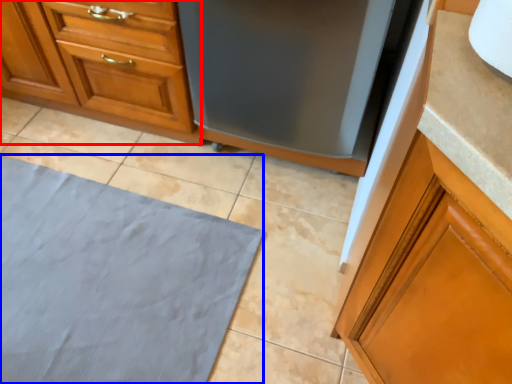
Question: Which of the following is the closest to the observer, cabinetry (highlighted by a red box) or bath mat (highlighted by a blue box)?

Choices:
 (A) cabinetry
 (B) bath mat

Answer: (B)